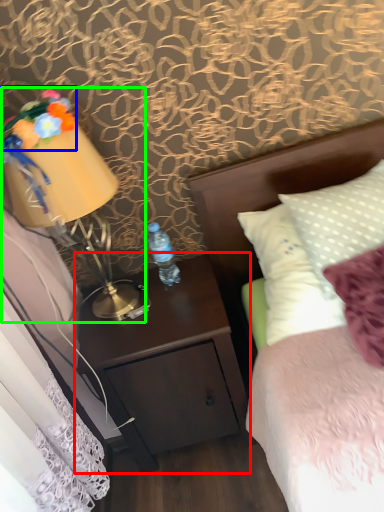
Question: Which object is positioned closest to nightstand (highlighted by a red box)? Select from flower (highlighted by a blue box) and bedside lamp (highlighted by a green box).

Choices:
 (A) flower
 (B) bedside lamp

Answer: (B)